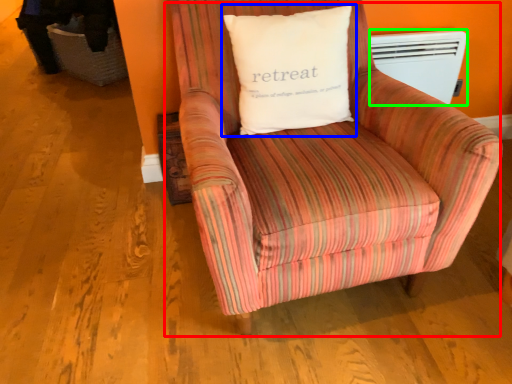
Question: Estimate the real-world distances between objects in this image. Which object is closer to chair (highlighted by a red box), pillow (highlighted by a blue box) or heater (highlighted by a green box)?

Choices:
 (A) pillow
 (B) heater

Answer: (A)